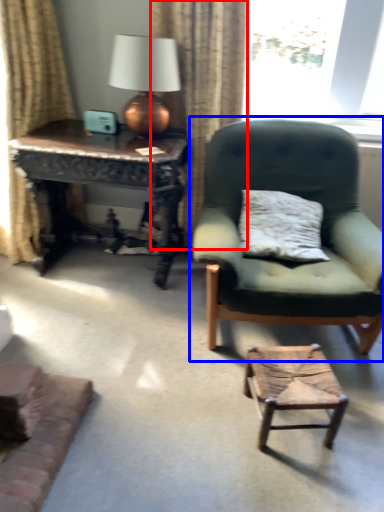
Question: Which object is further to the camera taking this photo, curtain (highlighted by a red box) or chair (highlighted by a blue box)?

Choices:
 (A) curtain
 (B) chair

Answer: (A)